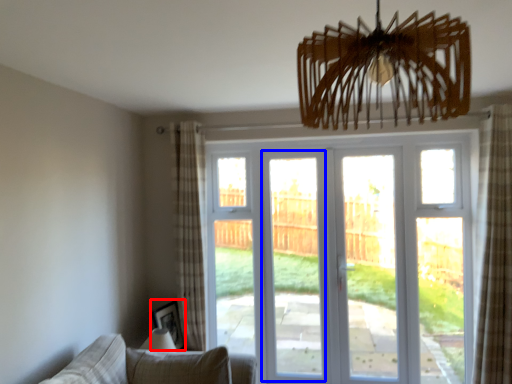
Question: Which object appears closest to the camera in this image, picture frame (highlighted by a red box) or screen door (highlighted by a blue box)?

Choices:
 (A) picture frame
 (B) screen door

Answer: (A)